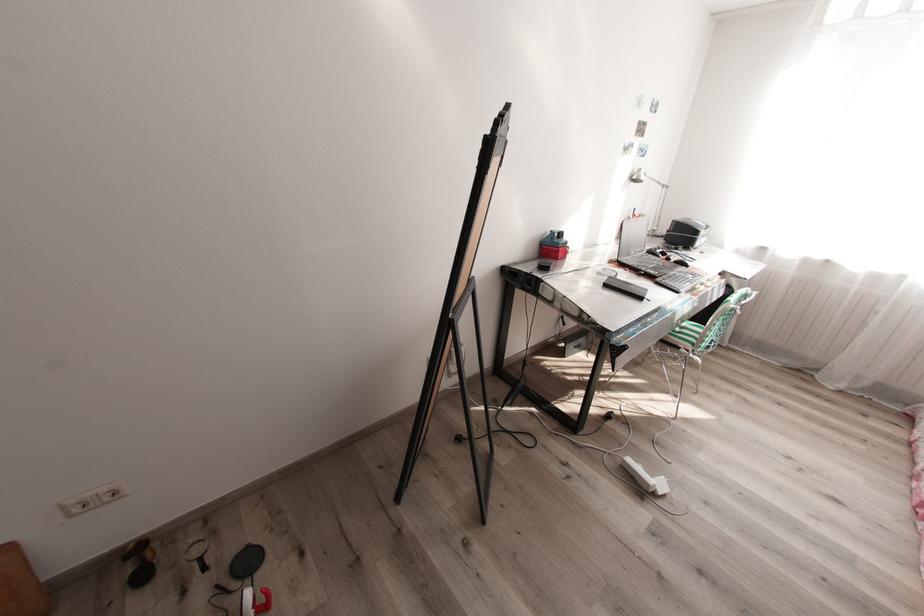
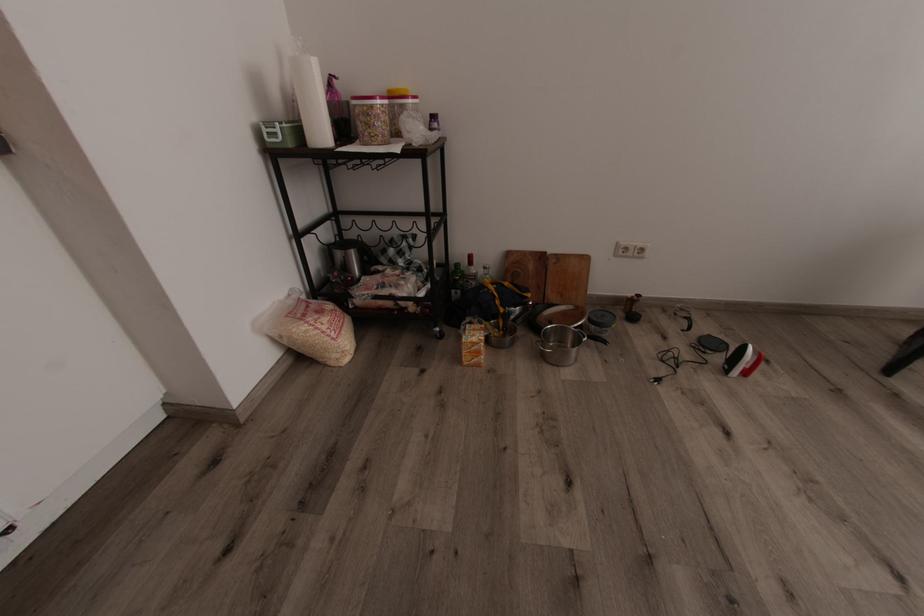
In the second image, find the point that corresponds to (x=210, y=523) in the first image.

(669, 310)